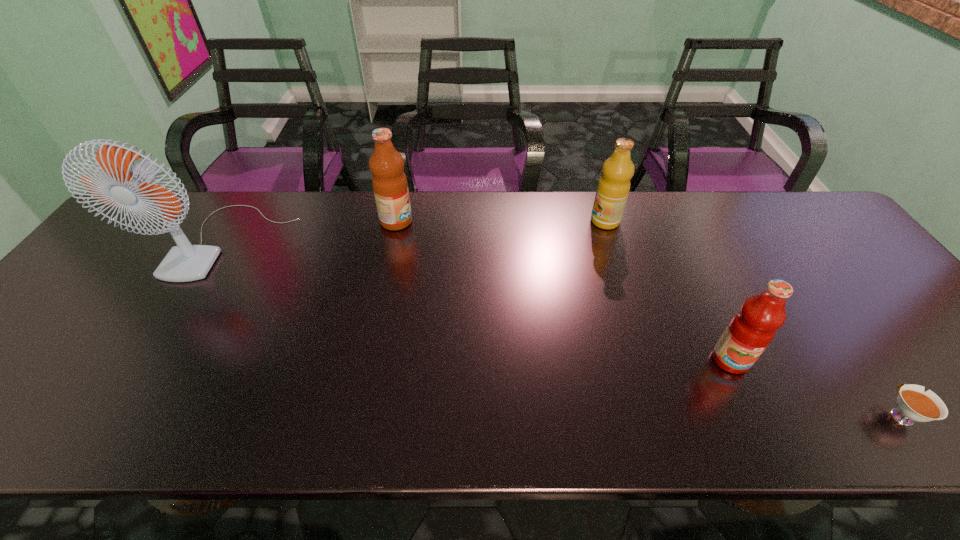
Find the location of a particular element. This screenshot has width=960, height=540. vacant region that satisfies the following two spatial constraints: 1. on the side of the shortest object with the handle; 2. on the front label of the second object from left to right is located at coordinates (763, 221).

I want to click on free spot that satisfies the following two spatial constraints: 1. on the front label of the second fruit juice from left to right; 2. on the front-facing side of the leftmost object, so click(x=612, y=241).

The width and height of the screenshot is (960, 540). In order to click on free space that satisfies the following two spatial constraints: 1. on the front label of the second object from left to right; 2. on the front-facing side of the leftmost object in this screenshot , I will do `click(393, 241)`.

Locate an element on the screen. The image size is (960, 540). vacant region that satisfies the following two spatial constraints: 1. on the side of the shortest object with the handle; 2. on the front label of the leftmost fruit juice is located at coordinates (763, 221).

Identify the location of free spot that satisfies the following two spatial constraints: 1. on the side of the nearest object with the handle; 2. on the front label of the leftmost fruit juice. This screenshot has width=960, height=540. (763, 221).